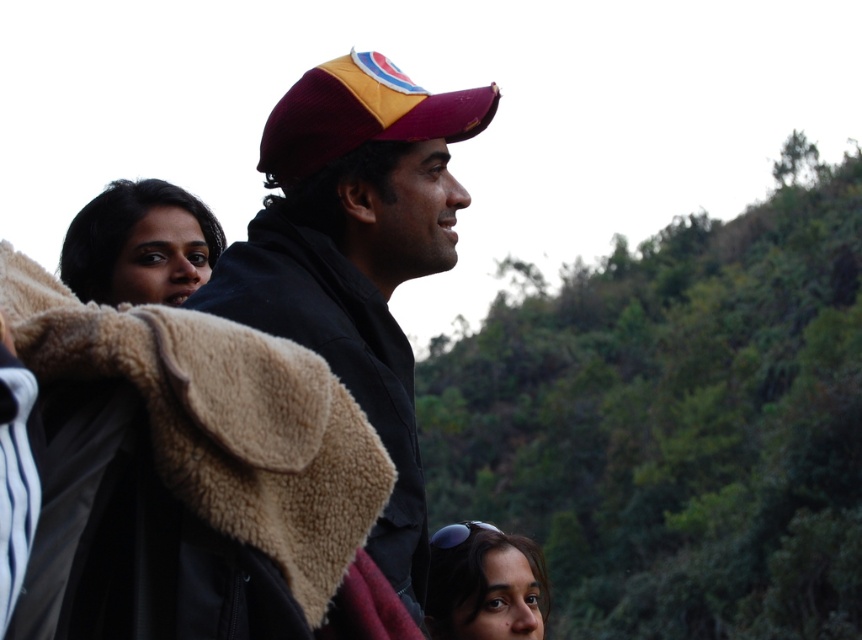
Can you confirm if beige fleece jacket at center is wider than smooth brown hair at lower center?

Yes.

Does beige fleece jacket at center have a larger size compared to smooth brown hair at lower center?

Incorrect, beige fleece jacket at center is not larger than smooth brown hair at lower center.

Describe the element at coordinates (182, 444) in the screenshot. I see `beige fleece jacket at center` at that location.

In order to click on beige fleece jacket at center in this screenshot , I will do `click(182, 444)`.

Is maroon ribbed baseball cap at upper center below smooth brown hair at lower center?

Actually, maroon ribbed baseball cap at upper center is above smooth brown hair at lower center.

The image size is (862, 640). What do you see at coordinates (361, 115) in the screenshot? I see `maroon ribbed baseball cap at upper center` at bounding box center [361, 115].

Locate an element on the screen. maroon ribbed baseball cap at upper center is located at coordinates (361, 115).

The width and height of the screenshot is (862, 640). I want to click on maroon ribbed baseball cap at upper center, so click(x=361, y=115).

Is maroon fabric cap at center wider than maroon ribbed baseball cap at upper center?

Indeed, maroon fabric cap at center has a greater width compared to maroon ribbed baseball cap at upper center.

Can you confirm if maroon fabric cap at center is thinner than maroon ribbed baseball cap at upper center?

No.

The width and height of the screenshot is (862, 640). What do you see at coordinates (355, 253) in the screenshot?
I see `maroon fabric cap at center` at bounding box center [355, 253].

Identify the location of maroon fabric cap at center. (355, 253).